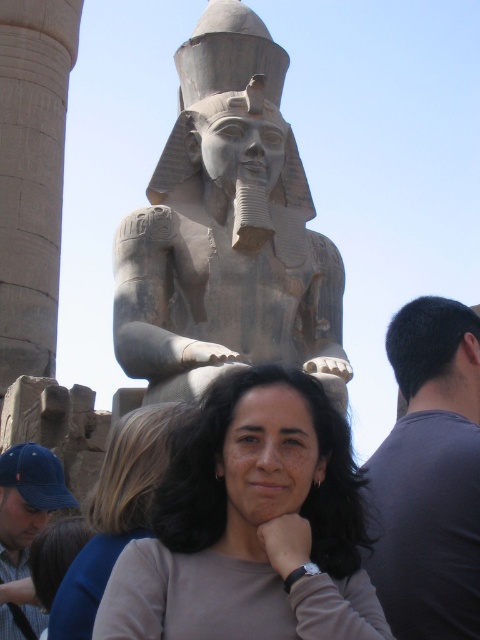
Question: Is the position of purple fabric shirt at upper right more distant than that of blue fabric cap at lower left?

Choices:
 (A) yes
 (B) no

Answer: (B)

Question: Which of these objects is positioned farthest from the purple fabric shirt at upper right?

Choices:
 (A) matte gray statue at center
 (B) smooth beige blouse at center

Answer: (B)

Question: Which point is farther to the camera?

Choices:
 (A) matte gray statue at center
 (B) blue fabric cap at lower left

Answer: (B)

Question: Can you confirm if matte gray statue at center is wider than purple fabric shirt at upper right?

Choices:
 (A) yes
 (B) no

Answer: (A)

Question: Among these points, which one is farthest from the camera?

Choices:
 (A) (12, 627)
 (B) (232, 433)
 (C) (48, 285)

Answer: (C)

Question: Does matte gray statue at center appear under smooth stone column at left?

Choices:
 (A) yes
 (B) no

Answer: (A)